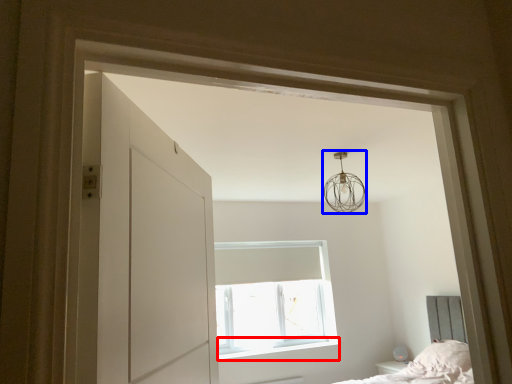
Question: Which of the following is the closest to the observer, window sill (highlighted by a red box) or lamp (highlighted by a blue box)?

Choices:
 (A) window sill
 (B) lamp

Answer: (B)